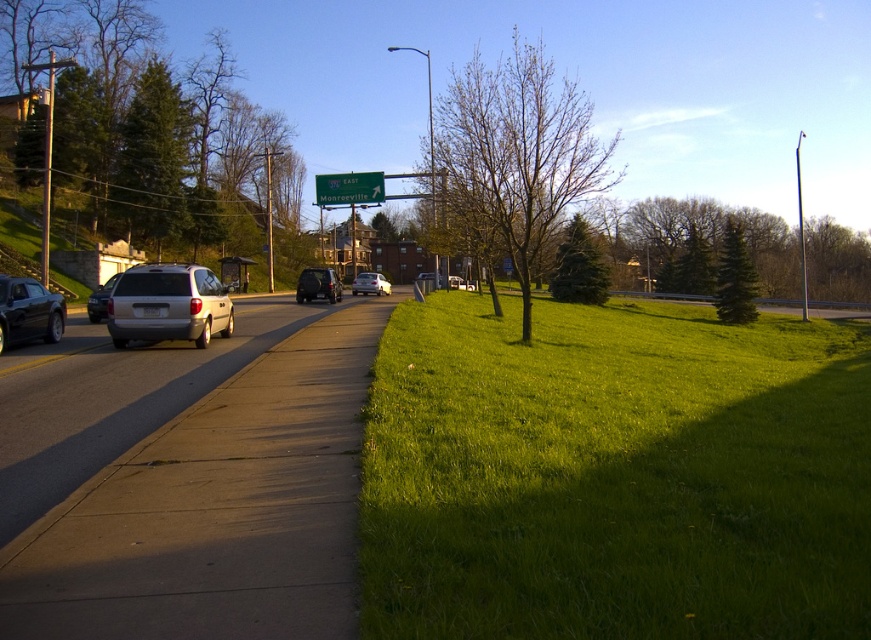
You are a delivery robot navigating a suburban street. You need to deliver a package to a house located at the end of the sidewalk. The sidewalk is at the center of the image. According to the coordinates provided, is the concrete sidewalk at center positioned closer to the road or the grassy area?

The concrete sidewalk at center is positioned closer to the road because its coordinates at point [215,509] place it near the road side of the image.

You are a pedestrian standing on the sidewalk and want to cross the road to reach the grassy area beyond. Which tree should you look towards for guidance, the green leafy tree at upper left or the bare brown tree at center?

You should look towards the green leafy tree at upper left because it is closer to you than the bare brown tree at center, so it would be a better reference point for crossing safely.

You are standing at point (64, 316) and want to walk to point (150, 433). Based on the scene description, will you have to walk towards or away from the silver minivan?

You will have to walk towards the silver minivan because point (150, 433) is in front of point (64, 316), meaning it is closer to the silver minivan which is moving towards the viewer.